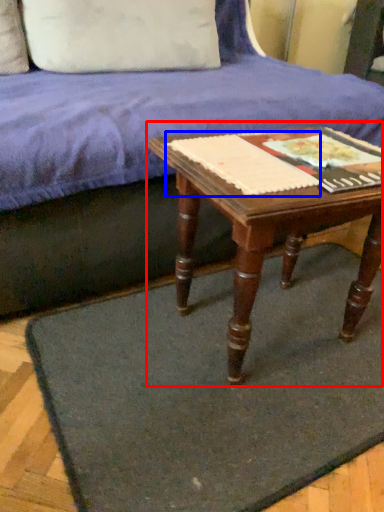
Question: Among these objects, which one is nearest to the camera, table (highlighted by a red box) or paperback book (highlighted by a blue box)?

Choices:
 (A) table
 (B) paperback book

Answer: (A)